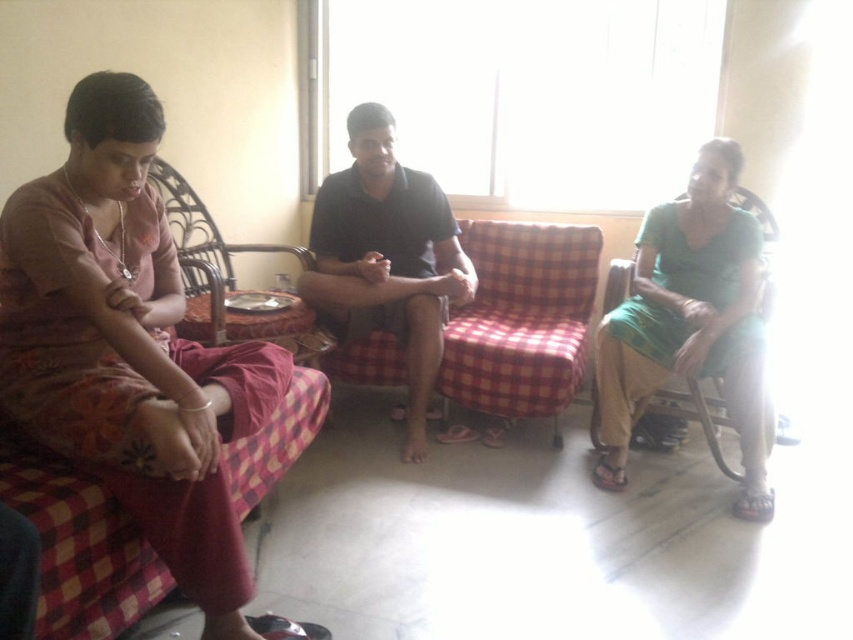
Question: Estimate the real-world distances between objects in this image. Which object is farther from the wicker chair at left?

Choices:
 (A) matte pink dress at left
 (B) plaid fabric couch at lower left

Answer: (A)

Question: Can you confirm if red checkered fabric couch at center is positioned to the left of plaid fabric couch at lower left?

Choices:
 (A) yes
 (B) no

Answer: (B)

Question: Is matte pink dress at left positioned in front of plaid fabric couch at lower left?

Choices:
 (A) yes
 (B) no

Answer: (B)

Question: Among these objects, which one is farthest from the camera?

Choices:
 (A) matte pink dress at left
 (B) red checkered fabric couch at center
 (C) green fabric dress at right

Answer: (B)

Question: Which point is farther from the camera taking this photo?

Choices:
 (A) (102, 504)
 (B) (253, 337)
 (C) (463, 321)
 (D) (688, 317)

Answer: (C)

Question: Is green fabric dress at right smaller than red checkered fabric couch at center?

Choices:
 (A) no
 (B) yes

Answer: (B)